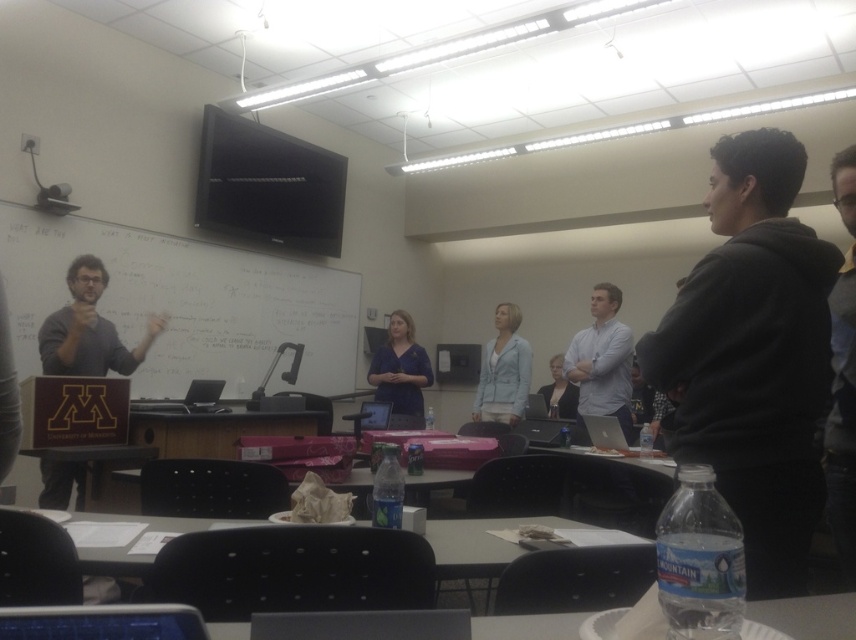
Who is positioned more to the left, dark gray hoodie at right or light blue fabric jacket at center?

Positioned to the left is light blue fabric jacket at center.

Between dark gray hoodie at right and light blue fabric jacket at center, which one appears on the right side from the viewer's perspective?

dark gray hoodie at right

Does point (765, 380) come behind point (518, 340)?

That is False.

Where is `dark gray hoodie at right`? The height and width of the screenshot is (640, 856). dark gray hoodie at right is located at coordinates (753, 355).

From the picture: Can you confirm if dark gray sweater at left is wider than wooden table at center?

Incorrect, dark gray sweater at left's width does not surpass wooden table at center's.

Does dark gray sweater at left lie in front of wooden table at center?

No, it is behind wooden table at center.

Image resolution: width=856 pixels, height=640 pixels. I want to click on dark gray sweater at left, so click(88, 330).

Where is `matte blue shirt at center`? This screenshot has height=640, width=856. matte blue shirt at center is located at coordinates (400, 368).

Consider the image. Can you confirm if matte blue shirt at center is bigger than light gray sweater at center?

Correct, matte blue shirt at center is larger in size than light gray sweater at center.

This screenshot has height=640, width=856. What do you see at coordinates (400, 368) in the screenshot? I see `matte blue shirt at center` at bounding box center [400, 368].

The height and width of the screenshot is (640, 856). Identify the location of matte blue shirt at center. (400, 368).